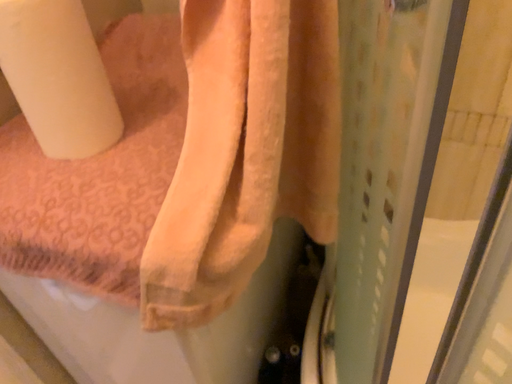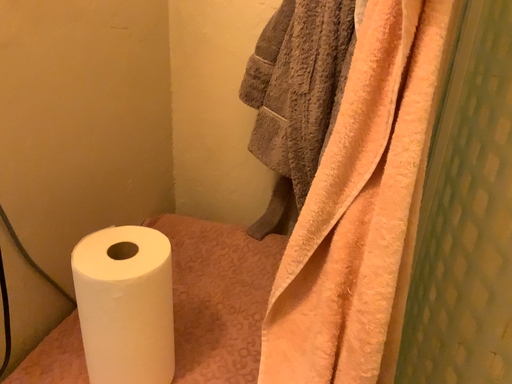
Question: How did the camera likely rotate when shooting the video?

Choices:
 (A) rotated downward
 (B) rotated upward

Answer: (B)